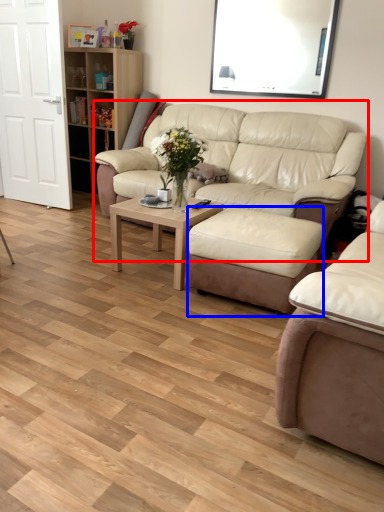
Question: Which point is further to the camera, studio couch (highlighted by a red box) or stool (highlighted by a blue box)?

Choices:
 (A) studio couch
 (B) stool

Answer: (A)